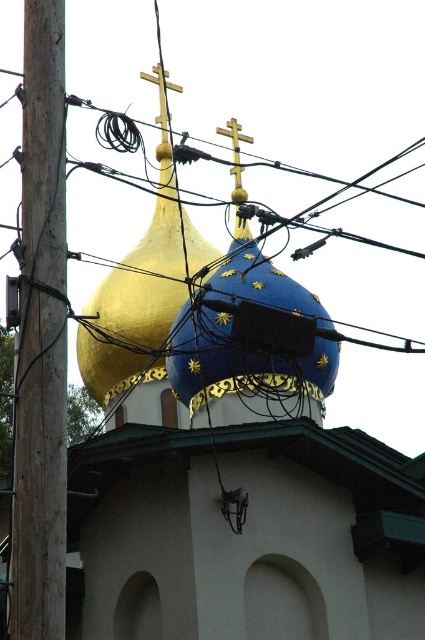
You are a maintenance worker needing to reach both the gold polished metal cross at center and the gold metallic cross at upper center. Given that your ladder can extend up to 30 feet, can you safely reach both crosses without moving the ladder?

The distance between the gold polished metal cross at center and the gold metallic cross at upper center is 34.16 feet. Since your ladder only extends to 30 feet, you cannot safely reach both crosses without moving the ladder.

You are a drone operator trying to fly a drone through the space between the wooden utility pole at left and the nearest dome. Based on the coordinates provided, can you determine if there is enough space for the drone to pass safely?

The wooden utility pole at left is located at coordinates point (x=40, y=339). Since the nearest dome is the gold dome on the left, which shares the same horizontal axis, the drone would need to navigate carefully to avoid collision. However, without knowing the exact dimensions of the drone and the distance between the pole and the dome, it is difficult to confirm safe passage. Please ensure proper clearance before attempting the flight.

You are an architect analyzing the building structure. You observe the gold metallic dome at upper center and the gold metallic cross at upper center. Which object appears bigger in the image?

The gold metallic dome at upper center is larger than the gold metallic cross at upper center, so the dome appears bigger in the image.